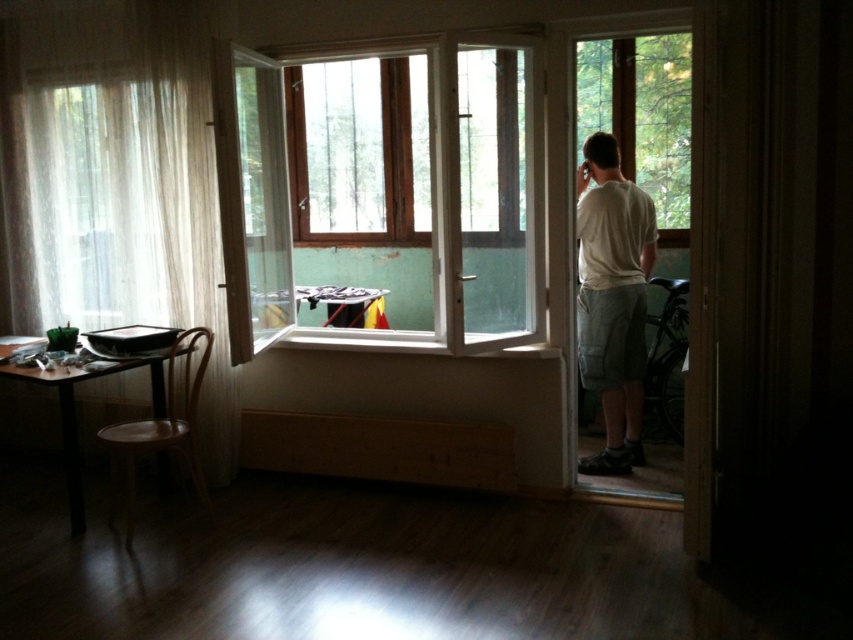
You are standing in the room and want to close the white sheer curtain at left. Based on its position, which wall is it located on?

The white sheer curtain at left is located on the left wall since it is at point (x=117, y=182), which corresponds to the left wall in the image.

You are standing in the room and want to place a small plant between the wooden frame at center and the white cotton shirt at right. Based on their positions, which object should the plant be closer to?

The wooden frame at center is to the left of the white cotton shirt at right, so the plant should be placed closer to the white cotton shirt at right to be between them.